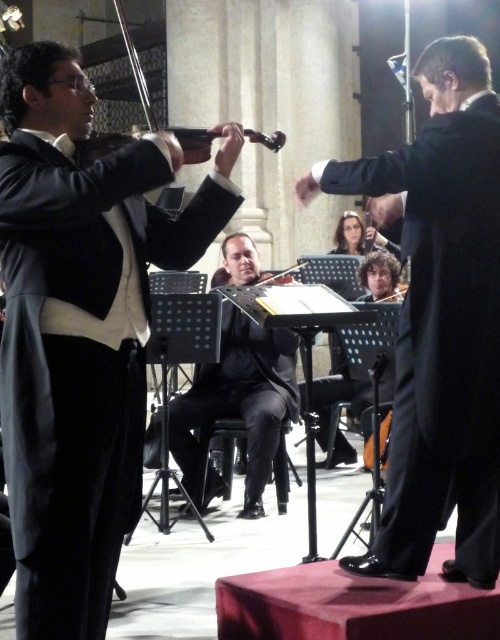
You are a photographer adjusting your camera settings to capture the orchestral performance. You notice two points in the scene at coordinates point (x=19, y=481) and point (x=329, y=465). Which point should you focus on to ensure it appears sharper in the photo?

Point (x=19, y=481) is closer to the camera than point (x=329, y=465), so focusing on point (x=19, y=481) will make it appear sharper in the photo.